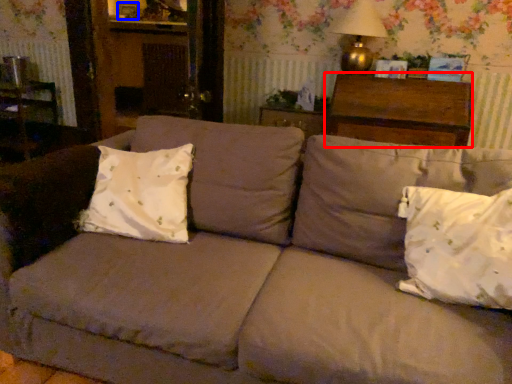
Question: Which object appears farthest to the camera in this image, hardwood (highlighted by a red box) or picture frame (highlighted by a blue box)?

Choices:
 (A) hardwood
 (B) picture frame

Answer: (B)